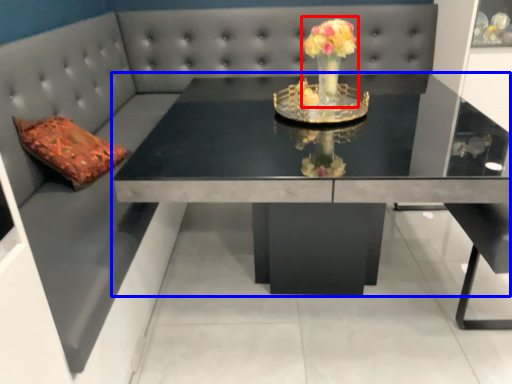
Question: Which point is closer to the camera, floral arrangement (highlighted by a red box) or table (highlighted by a blue box)?

Choices:
 (A) floral arrangement
 (B) table

Answer: (B)